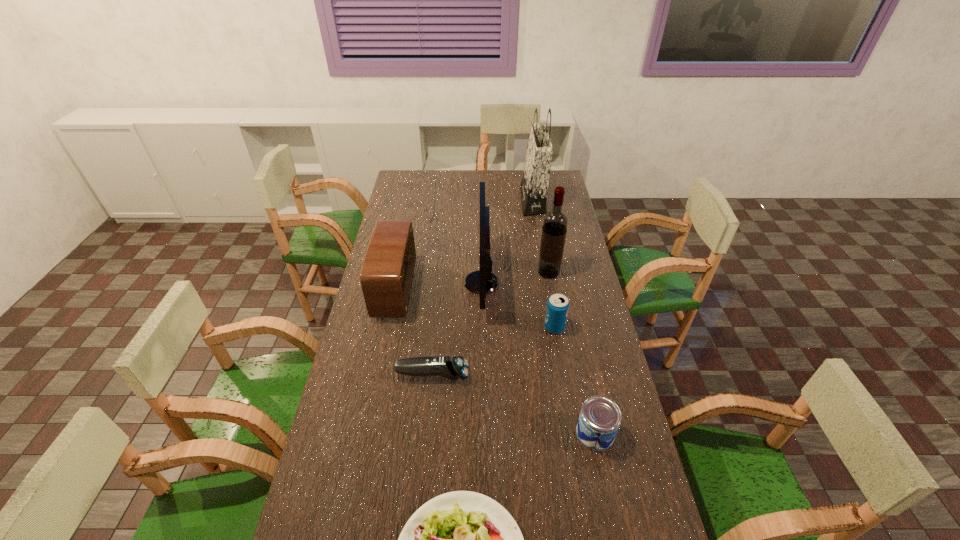
Locate an element on the screen. Image resolution: width=960 pixels, height=540 pixels. shopping bag is located at coordinates (534, 185).

Image resolution: width=960 pixels, height=540 pixels. In order to click on the tallest object in this screenshot , I will do `click(534, 185)`.

I want to click on the second tallest object, so click(555, 222).

Image resolution: width=960 pixels, height=540 pixels. Identify the location of the third tallest object. (482, 281).

This screenshot has width=960, height=540. What are the coordinates of `the fifth shortest object` in the screenshot? It's located at (386, 277).

Locate an element on the screen. Image resolution: width=960 pixels, height=540 pixels. soda can is located at coordinates (557, 308).

The height and width of the screenshot is (540, 960). Find the location of `the sixth tallest object`. the sixth tallest object is located at coordinates (600, 417).

This screenshot has width=960, height=540. In order to click on can in this screenshot , I will do `click(600, 417)`.

Locate an element on the screen. The height and width of the screenshot is (540, 960). the third nearest object is located at coordinates (454, 368).

I want to click on electric shaver, so click(x=454, y=368).